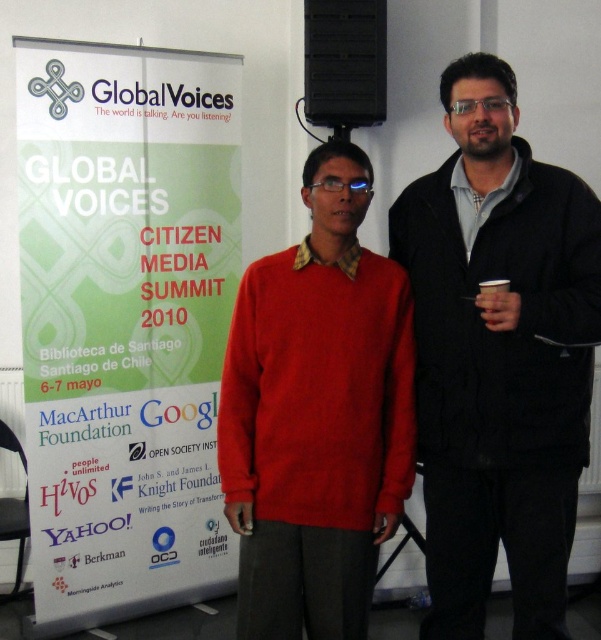
You are at the Global Voices Citizen Media Summit 2010 and want to grab the black paper cup at right without touching the black matte jacket at right. Is this possible based on their positions?

The black matte jacket at right is to the left of the black paper cup at right, so there is space between them. Therefore, you can grab the black paper cup at right without touching the black matte jacket at right.

You are at the Global Voices Citizen Media Summit 2010 and see a matte red sweater at center and a black paper cup at right. Which object is taller?

The matte red sweater at center is much taller than the black paper cup at right.

You are standing in front of the Global Voices Citizen Media Summit 2010 banner. You see a bright red sweater at center. Where is the point at coordinates (316, 413) located?

The point at coordinates (316, 413) is located on the matte red sweater at center.